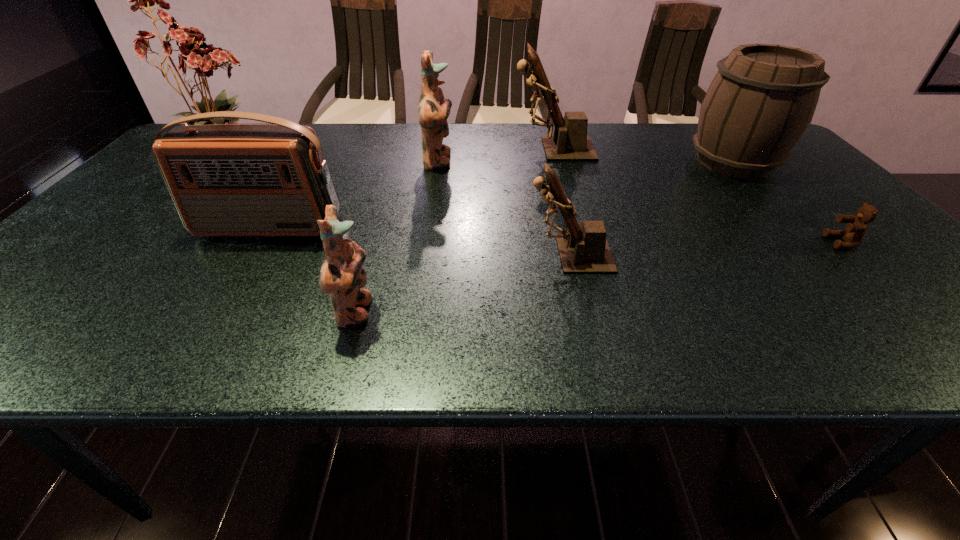
Identify which figurine is the third closest to the pink flower arrangement. Please provide its 2D coordinates. Your answer should be formatted as a tuple, i.e. [(x, y)], where the tuple contains the x and y coordinates of a point satisfying the conditions above.

[(570, 142)]

This screenshot has height=540, width=960. Identify the location of blank space that satisfies the following two spatial constraints: 1. on the front-facing side of the brown wine bucket; 2. on the left side of the pink flower arrangement. (225, 162).

What are the coordinates of `vacant region that satisfies the following two spatial constraints: 1. on the front side of the brown wine bucket; 2. on the front-facing side of the nearer pink figurine` in the screenshot? It's located at (870, 313).